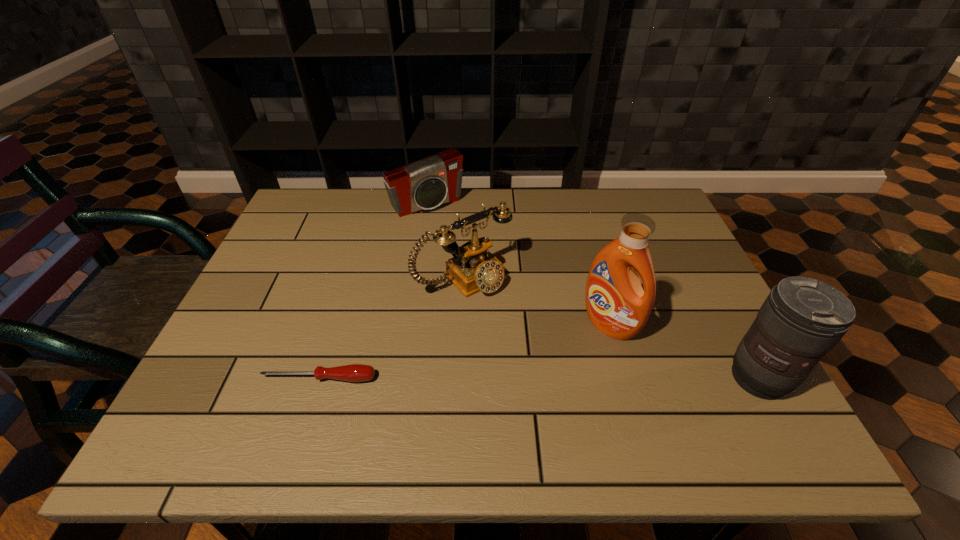
The image size is (960, 540). Find the location of `vacant space located on the front-facing side of the fourth tallest object`. vacant space located on the front-facing side of the fourth tallest object is located at coordinates [507, 300].

This screenshot has width=960, height=540. What are the coordinates of `vacant space located on the front-facing side of the fourth tallest object` in the screenshot? It's located at (469, 251).

Identify the location of free location located on the front-facing side of the third farthest object. This screenshot has width=960, height=540. (575, 356).

Where is `vacant space situated 0.120m on the front-facing side of the third farthest object`? The width and height of the screenshot is (960, 540). vacant space situated 0.120m on the front-facing side of the third farthest object is located at coordinates (560, 369).

At what (x,y) coordinates should I click in order to perform the action: click on free space located on the front-facing side of the third farthest object. Please return your answer as a coordinate pair (x, y). This screenshot has height=540, width=960. Looking at the image, I should click on (532, 395).

Image resolution: width=960 pixels, height=540 pixels. I want to click on free spot located on the dial number of the telephone, so click(569, 378).

The image size is (960, 540). What are the coordinates of `vacant area situated 0.080m on the dial number of the telephone` in the screenshot? It's located at (511, 318).

The image size is (960, 540). I want to click on vacant space located on the dial number of the telephone, so [x=547, y=355].

At what (x,y) coordinates should I click in order to perform the action: click on object that is positioned at the far edge. Please return your answer as a coordinate pair (x, y). This screenshot has height=540, width=960. Looking at the image, I should click on (436, 180).

Locate an element on the screen. Image resolution: width=960 pixels, height=540 pixels. screwdriver that is at the near edge is located at coordinates (354, 372).